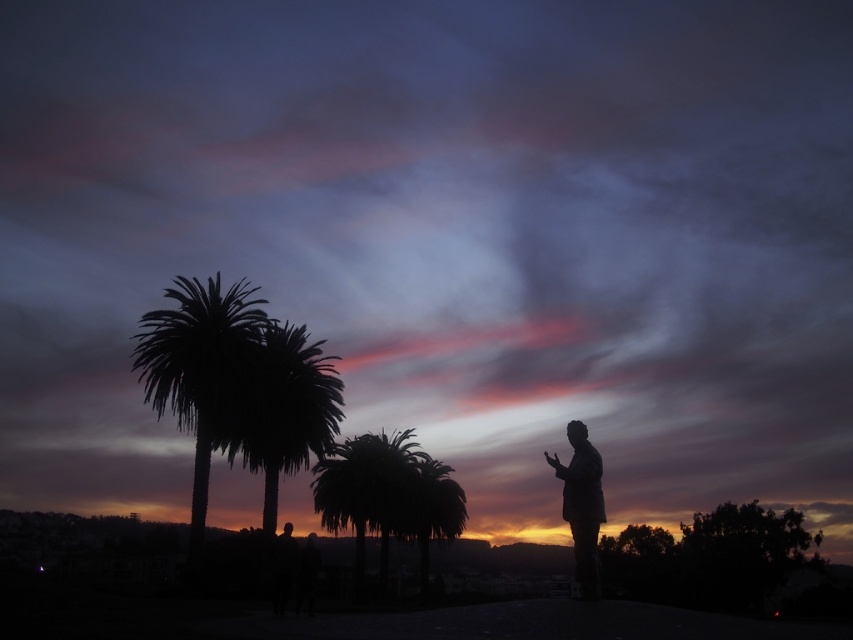
Question: Which point is farther to the camera?

Choices:
 (A) silhouette palm tree at center
 (B) silhouette statue at right

Answer: (A)

Question: Which point is closer to the camera taking this photo?

Choices:
 (A) (582, 500)
 (B) (148, 349)

Answer: (A)

Question: Does silhouette palm trees at left appear on the left side of silhouette statue at right?

Choices:
 (A) yes
 (B) no

Answer: (A)

Question: Can you confirm if silhouette palm tree at center is positioned above silhouette statue at right?

Choices:
 (A) no
 (B) yes

Answer: (B)

Question: Is silhouette palm trees at left bigger than silhouette statue at right?

Choices:
 (A) no
 (B) yes

Answer: (B)

Question: Which object is closer to the camera taking this photo?

Choices:
 (A) silhouette palm tree at center
 (B) silhouette palm trees at left

Answer: (B)